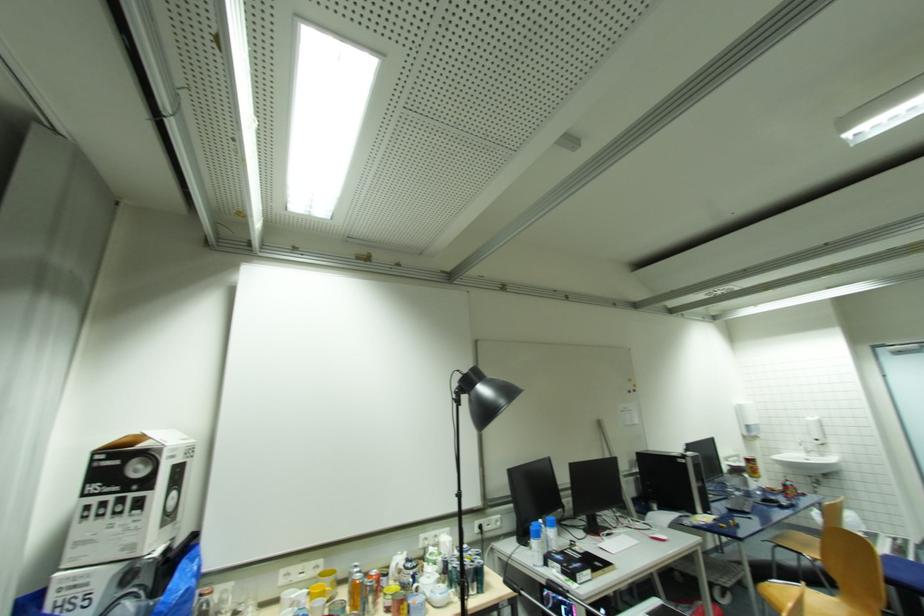
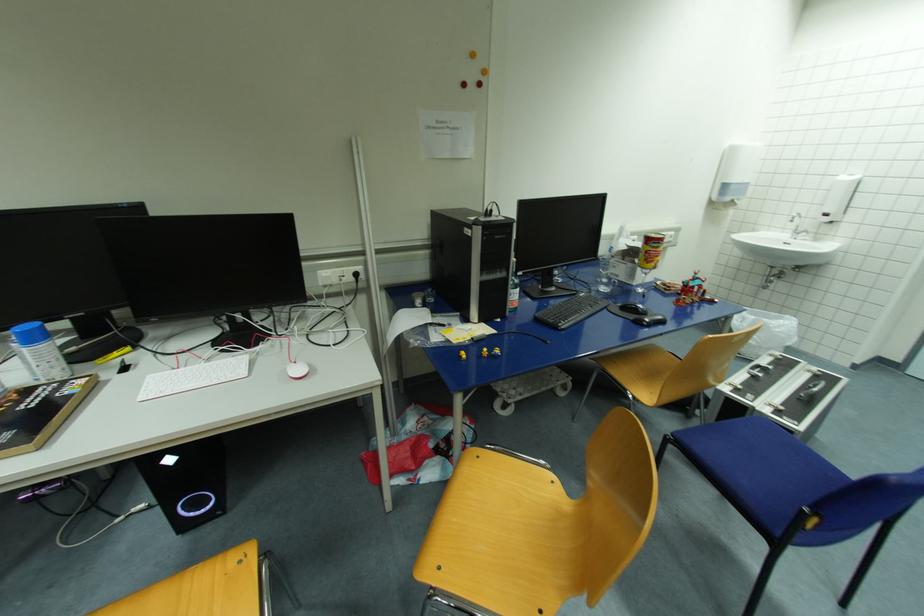
Find the pixel in the second image that matches [811,453] in the first image.

(799, 233)